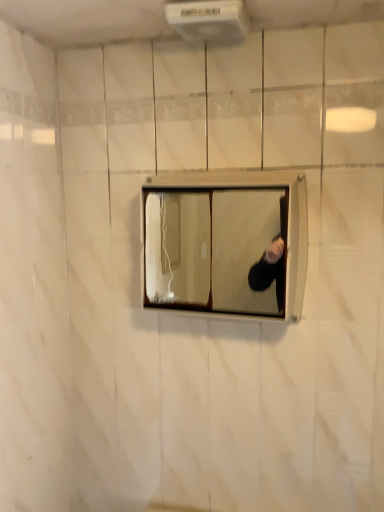
Question: Considering the relative sizes of white plastic air conditioner at upper center and matte wooden medicine cabinet at center in the image provided, is white plastic air conditioner at upper center shorter than matte wooden medicine cabinet at center?

Choices:
 (A) no
 (B) yes

Answer: (B)

Question: Is white plastic air conditioner at upper center far away from matte wooden medicine cabinet at center?

Choices:
 (A) yes
 (B) no

Answer: (B)

Question: From a real-world perspective, is white plastic air conditioner at upper center under matte wooden medicine cabinet at center?

Choices:
 (A) yes
 (B) no

Answer: (B)

Question: Does white plastic air conditioner at upper center appear on the right side of matte wooden medicine cabinet at center?

Choices:
 (A) yes
 (B) no

Answer: (B)

Question: Can you see white plastic air conditioner at upper center touching matte wooden medicine cabinet at center?

Choices:
 (A) yes
 (B) no

Answer: (B)

Question: Is white plastic air conditioner at upper center aimed at matte wooden medicine cabinet at center?

Choices:
 (A) yes
 (B) no

Answer: (B)

Question: Would you say matte wooden medicine cabinet at center is a long distance from white plastic air conditioner at upper center?

Choices:
 (A) no
 (B) yes

Answer: (A)

Question: From the image's perspective, would you say matte wooden medicine cabinet at center is shown under white plastic air conditioner at upper center?

Choices:
 (A) no
 (B) yes

Answer: (B)

Question: Can you confirm if matte wooden medicine cabinet at center is smaller than white plastic air conditioner at upper center?

Choices:
 (A) no
 (B) yes

Answer: (A)

Question: Considering the relative sizes of matte wooden medicine cabinet at center and white plastic air conditioner at upper center in the image provided, is matte wooden medicine cabinet at center bigger than white plastic air conditioner at upper center?

Choices:
 (A) no
 (B) yes

Answer: (B)

Question: Are matte wooden medicine cabinet at center and white plastic air conditioner at upper center making contact?

Choices:
 (A) yes
 (B) no

Answer: (B)

Question: Is matte wooden medicine cabinet at center oriented away from white plastic air conditioner at upper center?

Choices:
 (A) no
 (B) yes

Answer: (A)

Question: Is point (198, 17) closer or farther from the camera than point (223, 219)?

Choices:
 (A) closer
 (B) farther

Answer: (A)